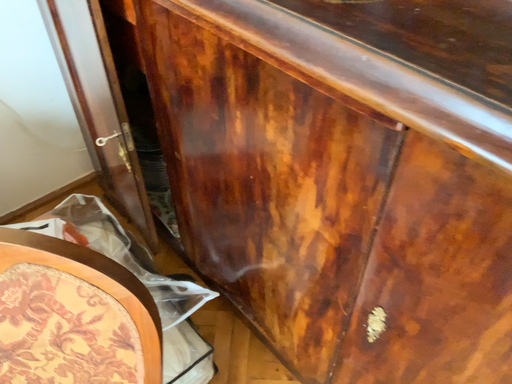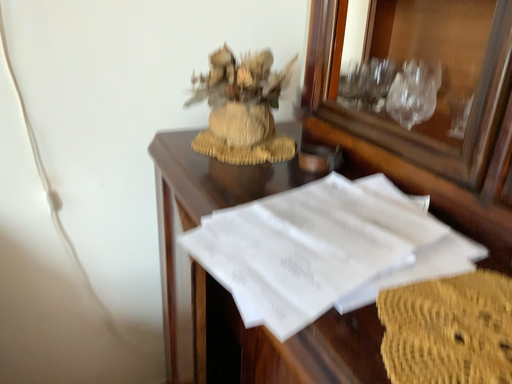
Question: How did the camera likely rotate when shooting the video?

Choices:
 (A) rotated upward
 (B) rotated downward

Answer: (A)